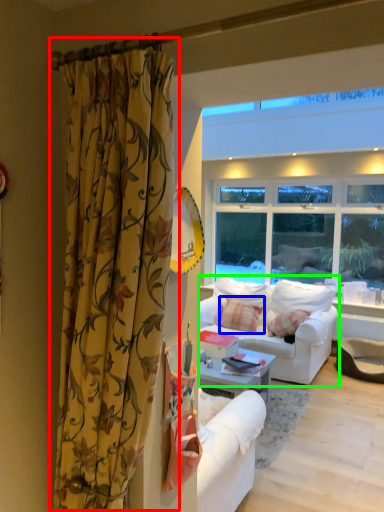
Question: Which object is the closest to the curtain (highlighted by a red box)? Choose among these: pillow (highlighted by a blue box) or studio couch (highlighted by a green box).

Choices:
 (A) pillow
 (B) studio couch

Answer: (B)